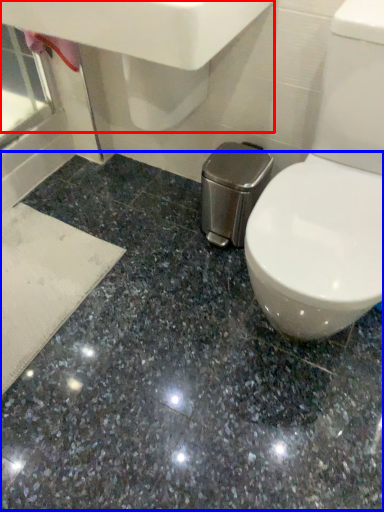
Question: Among these objects, which one is farthest to the camera, sink (highlighted by a red box) or granite (highlighted by a blue box)?

Choices:
 (A) sink
 (B) granite

Answer: (A)